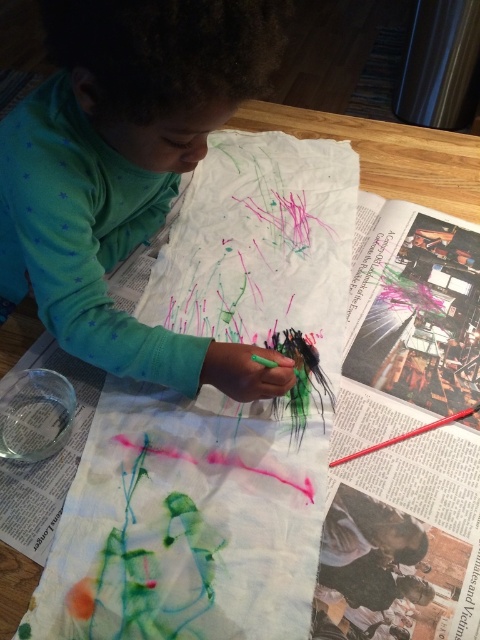
Who is more distant from viewer, (40, 132) or (471, 412)?

Positioned behind is point (471, 412).

Between green matte shirt at upper left and smooth red crayon at center, which one has less height?

smooth red crayon at center is shorter.

Which is in front, point (28, 269) or point (408, 436)?

Point (408, 436) is more forward.

Locate an element on the screen. The width and height of the screenshot is (480, 640). green matte shirt at upper left is located at coordinates (126, 170).